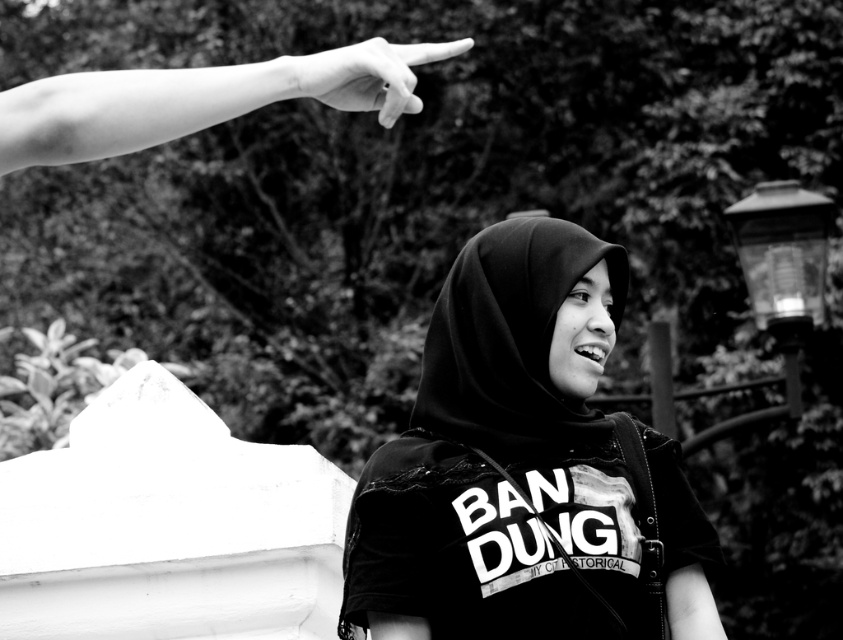
You are a photographer analyzing this image. You notice the black matte hijab at center and the smooth skin hand at upper left. Which object is closer to you in the image?

The black matte hijab at center is closer to you than the smooth skin hand at upper left because it is further to the viewer.

You are a photographer analyzing this black and white photo. You notice two elements in the upper left corner. One is a smooth skin hand at upper left and the other is a smooth skin finger at upper left. Based on the spatial relationship between them, which one would appear larger in the photo?

The smooth skin hand at upper left appears larger because it is closer to the viewer than the smooth skin finger at upper left.

You are a photographer analyzing the composition of this black and white photo. You notice the black matte hijab at center and the smooth skin finger at upper left. Based on their positions, which object is closer to the camera?

The smooth skin finger at upper left is closer to the camera because it is taller than the black matte hijab at center, indicating it occupies more space in the frame and thus proximity.